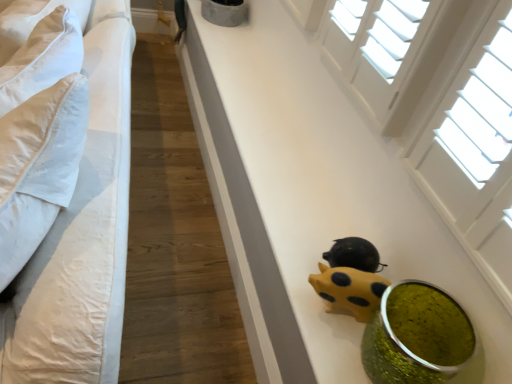
Where is `free space on the front side of yellow matte piggy bank at lower center`? free space on the front side of yellow matte piggy bank at lower center is located at coordinates (333, 339).